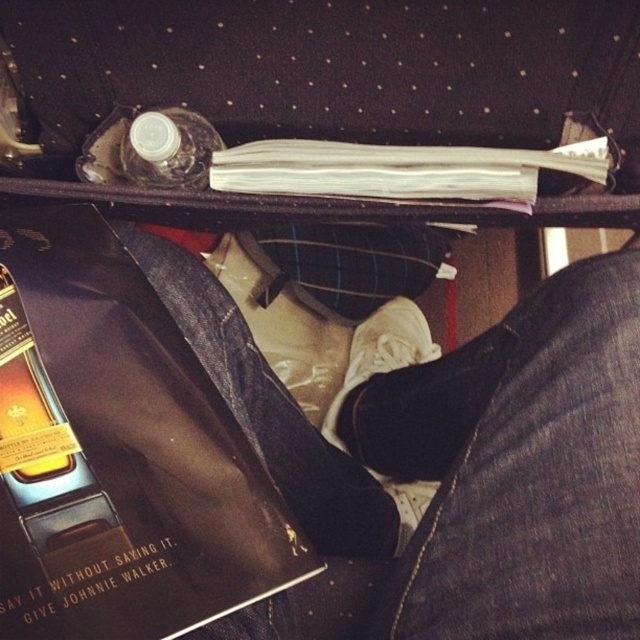
Which is below, shiny leather book at lower left or transparent plastic bottle at upper center?

shiny leather book at lower left is below.

Which of these two, shiny leather book at lower left or transparent plastic bottle at upper center, stands taller?

Standing taller between the two is shiny leather book at lower left.

You are a GUI agent. You are given a task and a screenshot of the screen. Output one action in this format:
    pyautogui.click(x=<x>, y=<y>)
    Task: Click on the shiny leather book at lower left
    
    Given the screenshot: What is the action you would take?
    pyautogui.click(x=129, y=458)

Between shiny leather book at lower left and white paper book at upper center, which one is positioned higher?

white paper book at upper center is higher up.

From the picture: Who is more forward, (x=211, y=451) or (x=236, y=177)?

Point (x=211, y=451) is more forward.

Where is `shiny leather book at lower left`? The image size is (640, 640). shiny leather book at lower left is located at coordinates (129, 458).

Based on the photo, does white paper book at upper center appear on the right side of white suede shoe at lower center?

Indeed, white paper book at upper center is positioned on the right side of white suede shoe at lower center.

Is point (451, 156) positioned before point (390, 356)?

Yes, point (451, 156) is closer to viewer.

Is point (582, 173) more distant than point (410, 300)?

That is False.

I want to click on white paper book at upper center, so click(403, 172).